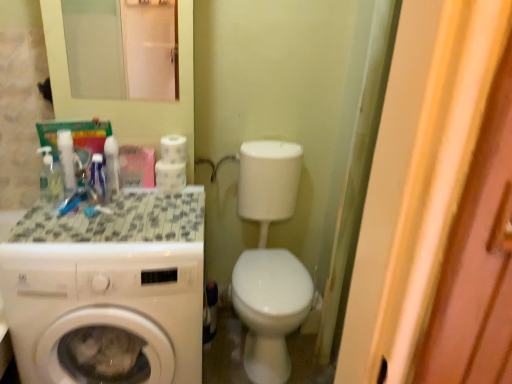
The image size is (512, 384). What do you see at coordinates (122, 48) in the screenshot?
I see `transparent glass mirror at upper center` at bounding box center [122, 48].

I want to click on transparent glass mirror at upper center, so tap(122, 48).

What is the approximate height of white glossy mouthwash at left, placed as the 2th mouthwash when sorted from right to left?

The height of white glossy mouthwash at left, placed as the 2th mouthwash when sorted from right to left, is 9.31 inches.

How much space does white glossy mouthwash at upper left, placed as the 1th mouthwash when sorted from right to left, occupy vertically?

It is 8.91 inches.

The height and width of the screenshot is (384, 512). Identify the location of clear plastic mouthwash at upper left, the first mouthwash from the left. (51, 177).

This screenshot has height=384, width=512. What do you see at coordinates (51, 177) in the screenshot?
I see `clear plastic mouthwash at upper left, arranged as the third mouthwash when viewed from the right` at bounding box center [51, 177].

What do you see at coordinates (172, 164) in the screenshot? This screenshot has height=384, width=512. I see `white matte toilet paper at center, placed as the 1th toilet paper when sorted from bottom to top` at bounding box center [172, 164].

Identify the location of transparent glass mirror at upper center. This screenshot has height=384, width=512. (122, 48).

Locate an element on the screen. Image resolution: width=512 pixels, height=384 pixels. the 3rd mouthwash to the left of the white glossy washing machine at left, counting from the anchor's position is located at coordinates (51, 177).

What's the angular difference between white glossy washing machine at left and clear plastic mouthwash at upper left, the first mouthwash from the left,'s facing directions?

There is a 29.4-degree angle between the facing directions of white glossy washing machine at left and clear plastic mouthwash at upper left, the first mouthwash from the left.

Is white glossy washing machine at left positioned beyond the bounds of clear plastic mouthwash at upper left, arranged as the third mouthwash when viewed from the right?

Yes.

Does point (179, 156) come farther from viewer compared to point (233, 156)?

No, (179, 156) is closer to viewer.

Is white matte toilet paper at upper center, which is counted as the first toilet paper, starting from the top, behind white glossy faucet at upper center?

No, white matte toilet paper at upper center, which is counted as the first toilet paper, starting from the top, is closer to the viewer.

Measure the distance from white matte toilet paper at upper center, which is counted as the first toilet paper, starting from the top, to white glossy faucet at upper center.

They are 32.32 centimeters apart.

Is white matte toilet paper at upper center, which is the 2th toilet paper in bottom-to-top order, shorter than white glossy faucet at upper center?

Indeed, white matte toilet paper at upper center, which is the 2th toilet paper in bottom-to-top order, has a lesser height compared to white glossy faucet at upper center.

In the image, is white matte toilet paper at upper center, which is counted as the first toilet paper, starting from the top, positioned in front of or behind white matte toilet paper at center, placed as the 1th toilet paper when sorted from bottom to top?

white matte toilet paper at upper center, which is counted as the first toilet paper, starting from the top, is positioned closer to the viewer than white matte toilet paper at center, placed as the 1th toilet paper when sorted from bottom to top.

Is white matte toilet paper at upper center, which is counted as the first toilet paper, starting from the top, located outside white matte toilet paper at center, arranged as the 2th toilet paper when viewed from the top?

Yes, white matte toilet paper at upper center, which is counted as the first toilet paper, starting from the top, is not within white matte toilet paper at center, arranged as the 2th toilet paper when viewed from the top.

How far apart are tile mosaic countertop at left and white glossy faucet at upper center?

tile mosaic countertop at left and white glossy faucet at upper center are 23.51 inches apart.

Considering the positions of point (138, 205) and point (229, 160), is point (138, 205) closer or farther from the camera than point (229, 160)?

Point (138, 205).

Can you tell me how much tile mosaic countertop at left and white glossy faucet at upper center differ in facing direction?

tile mosaic countertop at left and white glossy faucet at upper center are facing 1.67 degrees away from each other.

Which object is thinner, tile mosaic countertop at left or white glossy faucet at upper center?

white glossy faucet at upper center is thinner.

Can you confirm if white matte toilet paper at center, placed as the 1th toilet paper when sorted from bottom to top, is thinner than white glossy mouthwash at upper left, which is the third mouthwash from left to right?

In fact, white matte toilet paper at center, placed as the 1th toilet paper when sorted from bottom to top, might be wider than white glossy mouthwash at upper left, which is the third mouthwash from left to right.

Who is taller, white matte toilet paper at center, arranged as the 2th toilet paper when viewed from the top, or white glossy mouthwash at upper left, placed as the 1th mouthwash when sorted from right to left?

white glossy mouthwash at upper left, placed as the 1th mouthwash when sorted from right to left, is taller.

The image size is (512, 384). I want to click on the 2nd mouthwash above the white matte toilet paper at center, placed as the 1th toilet paper when sorted from bottom to top (from a real-world perspective), so click(111, 167).

From the image's perspective, is white glossy mouthwash at upper left, which is the third mouthwash from left to right, beneath clear plastic mouthwash at upper left, the first mouthwash from the left?

No, from the image's perspective, white glossy mouthwash at upper left, which is the third mouthwash from left to right, is not beneath clear plastic mouthwash at upper left, the first mouthwash from the left.

Consider the image. Is white glossy mouthwash at upper left, which is the third mouthwash from left to right, looking in the opposite direction of clear plastic mouthwash at upper left, the first mouthwash from the left?

No, clear plastic mouthwash at upper left, the first mouthwash from the left, is not at the back of white glossy mouthwash at upper left, which is the third mouthwash from left to right.

Considering the relative sizes of white glossy mouthwash at upper left, which is the third mouthwash from left to right, and clear plastic mouthwash at upper left, arranged as the third mouthwash when viewed from the right, in the image provided, is white glossy mouthwash at upper left, which is the third mouthwash from left to right, shorter than clear plastic mouthwash at upper left, arranged as the third mouthwash when viewed from the right,?

Incorrect, the height of white glossy mouthwash at upper left, which is the third mouthwash from left to right, does not fall short of that of clear plastic mouthwash at upper left, arranged as the third mouthwash when viewed from the right.

Is clear plastic mouthwash at upper left, arranged as the third mouthwash when viewed from the right, completely or partially inside white glossy mouthwash at left, placed as the 2th mouthwash when sorted from right to left?

No.

From a real-world perspective, which object stands above the other?

white glossy mouthwash at left, which is the second mouthwash in left-to-right order.

Is white glossy mouthwash at left, placed as the 2th mouthwash when sorted from right to left, bigger than clear plastic mouthwash at upper left, the first mouthwash from the left?

Incorrect, white glossy mouthwash at left, placed as the 2th mouthwash when sorted from right to left, is not larger than clear plastic mouthwash at upper left, the first mouthwash from the left.

Is white glossy mouthwash at left, which is the second mouthwash in left-to-right order, with clear plastic mouthwash at upper left, arranged as the third mouthwash when viewed from the right?

Yes, the surface of white glossy mouthwash at left, which is the second mouthwash in left-to-right order, is in contact with clear plastic mouthwash at upper left, arranged as the third mouthwash when viewed from the right.

Locate an element on the screen. mouthwash that is the 1st object located above the white glossy washing machine at left (from the image's perspective) is located at coordinates (51, 177).

Where is `the 2nd toilet paper in front of the white glossy faucet at upper center, starting your count from the anchor`? The height and width of the screenshot is (384, 512). the 2nd toilet paper in front of the white glossy faucet at upper center, starting your count from the anchor is located at coordinates (173, 149).

Based on their spatial positions, is white glossy washing machine at left or white glossy faucet at upper center further from white matte toilet paper at center, placed as the 1th toilet paper when sorted from bottom to top?

white glossy washing machine at left is positioned further to the anchor white matte toilet paper at center, placed as the 1th toilet paper when sorted from bottom to top.

Looking at the image, which one is located further to white glossy mouthwash at left, which is the second mouthwash in left-to-right order, transparent glass mirror at upper center or white glossy faucet at upper center?

white glossy faucet at upper center is positioned further to the anchor white glossy mouthwash at left, which is the second mouthwash in left-to-right order.

From the image, which object appears to be farther from white glossy mouthwash at upper left, placed as the 1th mouthwash when sorted from right to left, transparent glass mirror at upper center or white matte toilet paper at upper center, which is the 2th toilet paper in bottom-to-top order?

The object further to white glossy mouthwash at upper left, placed as the 1th mouthwash when sorted from right to left, is transparent glass mirror at upper center.

Looking at this image, which object lies further to the anchor point tile mosaic countertop at left, white glossy mouthwash at left, which is the second mouthwash in left-to-right order, or transparent glass mirror at upper center?

transparent glass mirror at upper center is further to tile mosaic countertop at left.

When comparing their distances from white glossy mouthwash at upper left, placed as the 1th mouthwash when sorted from right to left, does clear plastic mouthwash at upper left, the first mouthwash from the left, or white glossy faucet at upper center seem closer?

clear plastic mouthwash at upper left, the first mouthwash from the left, lies closer to white glossy mouthwash at upper left, placed as the 1th mouthwash when sorted from right to left, than the other object.

Considering their positions, is white glossy mouthwash at upper left, which is the third mouthwash from left to right, positioned closer to clear plastic mouthwash at upper left, the first mouthwash from the left, than transparent glass mirror at upper center?

white glossy mouthwash at upper left, which is the third mouthwash from left to right, is closer to clear plastic mouthwash at upper left, the first mouthwash from the left.

From the image, which object appears to be nearer to white matte toilet paper at upper center, which is counted as the first toilet paper, starting from the top, white glossy mouthwash at upper left, which is the third mouthwash from left to right, or white glossy washing machine at left?

white glossy mouthwash at upper left, which is the third mouthwash from left to right.

Based on their spatial positions, is white glossy washing machine at left or white glossy faucet at upper center closer to clear plastic mouthwash at upper left, arranged as the third mouthwash when viewed from the right?

The object closer to clear plastic mouthwash at upper left, arranged as the third mouthwash when viewed from the right, is white glossy washing machine at left.

Where is `toilet paper between white glossy mouthwash at upper left, which is the third mouthwash from left to right, and white glossy washing machine at left, in the vertical direction`? toilet paper between white glossy mouthwash at upper left, which is the third mouthwash from left to right, and white glossy washing machine at left, in the vertical direction is located at coordinates point(172,164).

Identify the location of counter top between white matte toilet paper at upper center, which is counted as the first toilet paper, starting from the top, and white glossy washing machine at left in the up-down direction. (120, 220).

What are the coordinates of `mouthwash between white glossy mouthwash at left, which is the second mouthwash in left-to-right order, and white matte toilet paper at upper center, which is counted as the first toilet paper, starting from the top, in the horizontal direction` in the screenshot? It's located at (111, 167).

You are a GUI agent. You are given a task and a screenshot of the screen. Output one action in this format:
    pyautogui.click(x=<x>, y=<y>)
    Task: Click on the mouthwash situated between white glossy mouthwash at left, which is the second mouthwash in left-to-right order, and white matte toilet paper at center, placed as the 1th toilet paper when sorted from bottom to top, from left to right
    
    Given the screenshot: What is the action you would take?
    (x=111, y=167)